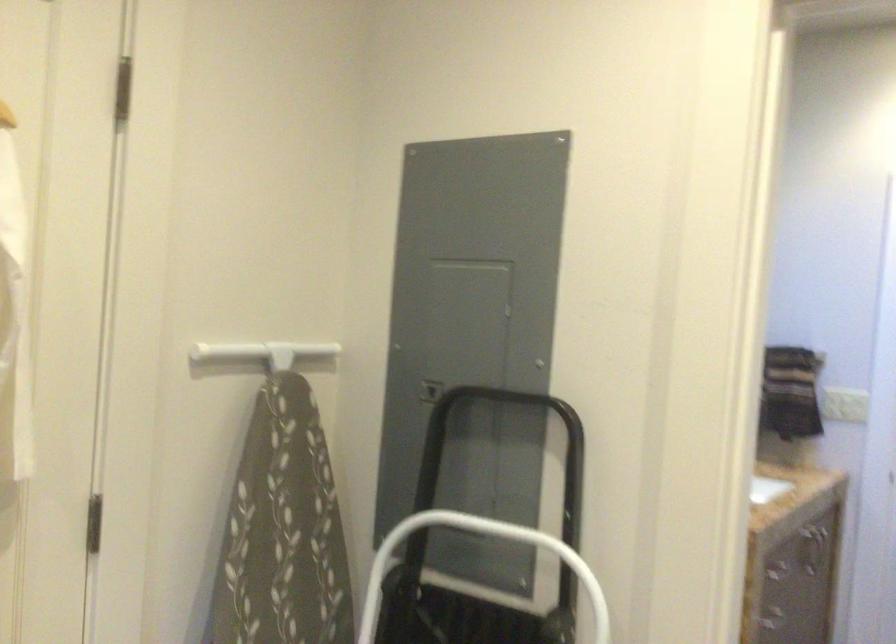
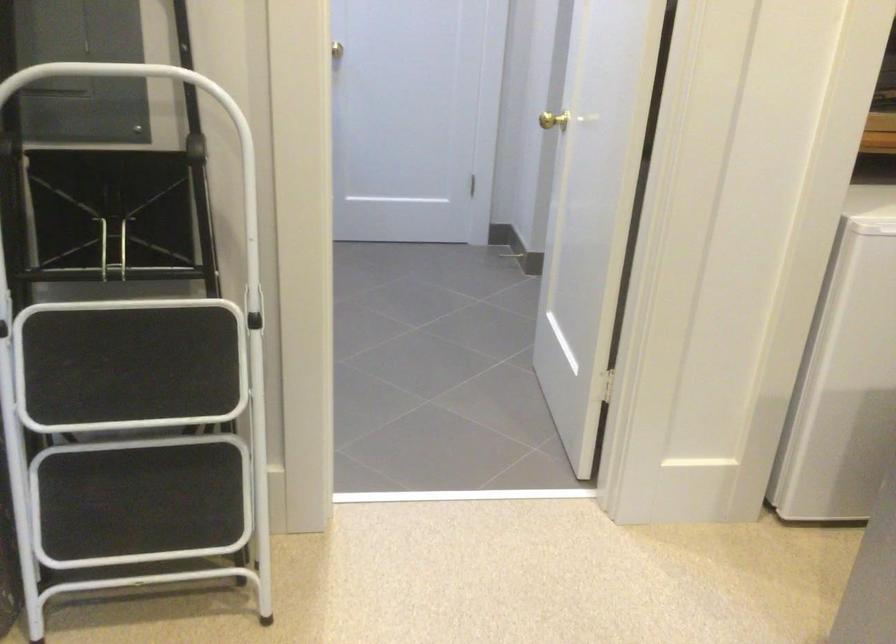
How did the camera likely rotate?

The camera's rotation is toward right-down.